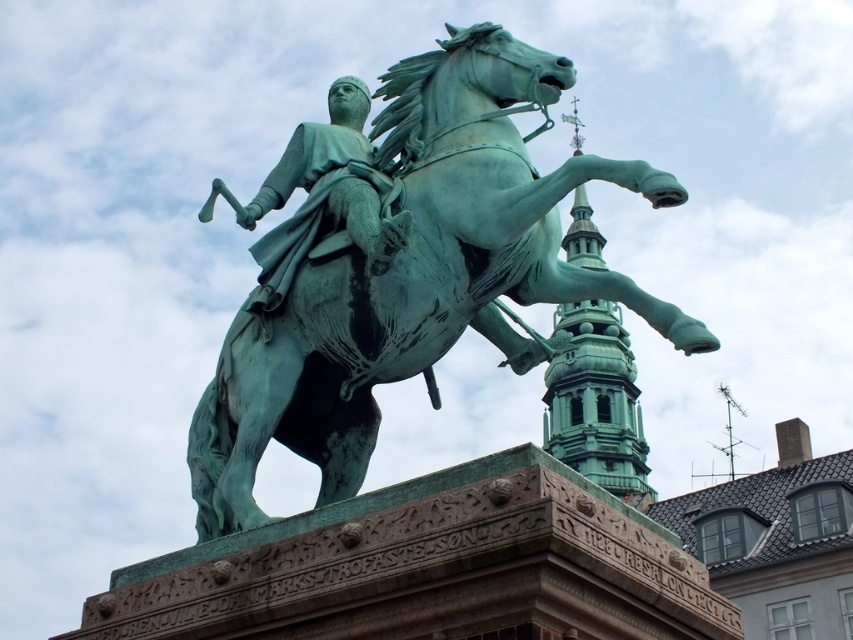
Question: Which object is positioned closest to the green patina horse at center?

Choices:
 (A) green patinated bronze statue at center
 (B) green patina tower at upper center

Answer: (A)

Question: Which point appears farthest from the camera in this image?

Choices:
 (A) (213, 460)
 (B) (303, 160)

Answer: (B)

Question: Considering the real-world distances, which object is farthest from the green patinated bronze statue at center?

Choices:
 (A) green patina horse at center
 (B) green patina tower at upper center

Answer: (B)

Question: Can you confirm if green patinated bronze statue at center is thinner than green patina tower at upper center?

Choices:
 (A) no
 (B) yes

Answer: (B)

Question: Where is green patina horse at center located in relation to green patina tower at upper center in the image?

Choices:
 (A) above
 (B) below

Answer: (A)

Question: Does green patina horse at center have a greater width compared to green patina tower at upper center?

Choices:
 (A) no
 (B) yes

Answer: (A)